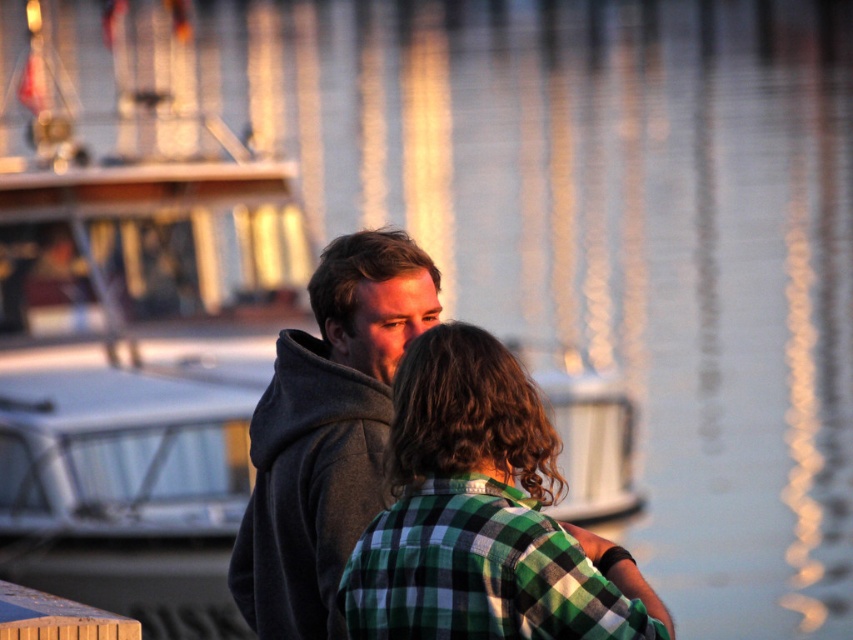
Does green plaid shirt at center come behind gray hoodie at center?

That is False.

Is green plaid shirt at center taller than gray hoodie at center?

Indeed, green plaid shirt at center has a greater height compared to gray hoodie at center.

Which is in front, point (437, 532) or point (297, 515)?

Point (437, 532) is more forward.

Find the location of `green plaid shirt at center`. green plaid shirt at center is located at coordinates (482, 516).